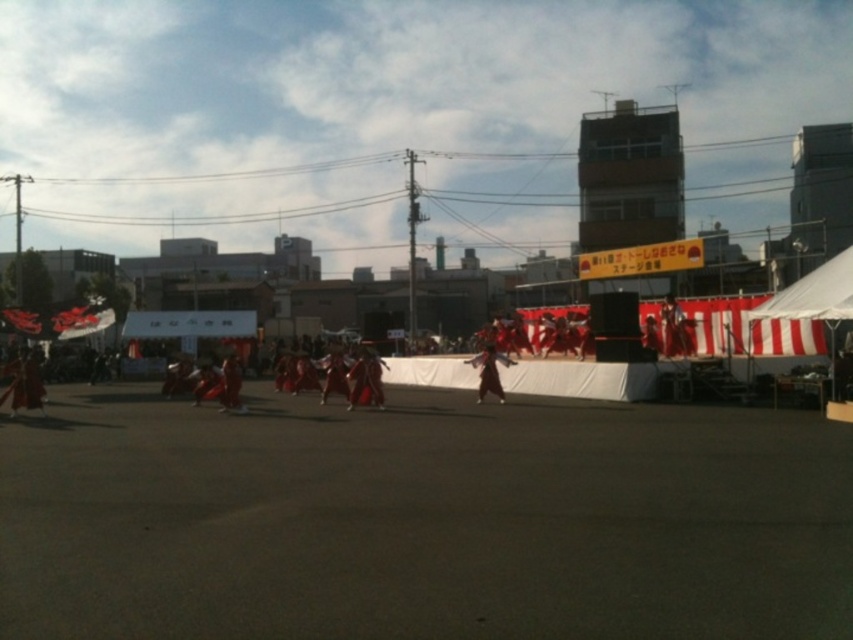
Can you confirm if red satin kimono at center is smaller than red silk kimono at center?

Yes.

Can you confirm if red satin kimono at center is bigger than red silk kimono at center?

No, red satin kimono at center is not bigger than red silk kimono at center.

This screenshot has width=853, height=640. Find the location of `red satin kimono at center`. red satin kimono at center is located at coordinates (489, 371).

This screenshot has height=640, width=853. I want to click on red satin kimono at center, so click(489, 371).

Describe the element at coordinates (674, 330) in the screenshot. I see `matte red kimono at center` at that location.

The height and width of the screenshot is (640, 853). In order to click on matte red kimono at center in this screenshot , I will do `click(674, 330)`.

Which is behind, point (688, 348) or point (234, 368)?

The point (688, 348) is behind.

Image resolution: width=853 pixels, height=640 pixels. What are the coordinates of `matte red kimono at center` in the screenshot? It's located at (674, 330).

From the picture: Does matte red kimono at center have a lesser width compared to red satin kimono at center?

In fact, matte red kimono at center might be wider than red satin kimono at center.

Is point (688, 349) positioned after point (498, 388)?

Yes, point (688, 349) is farther from viewer.

Which is in front, point (670, 307) or point (480, 355)?

Point (480, 355) is in front.

The width and height of the screenshot is (853, 640). Identify the location of matte red kimono at center. (674, 330).